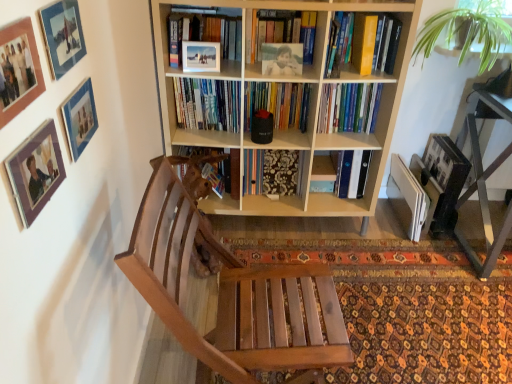
This screenshot has width=512, height=384. Identify the location of matte glass picture frame at upper left, arranged as the 4th picture frame when ordered from the bottom. (62, 36).

Image resolution: width=512 pixels, height=384 pixels. Describe the element at coordinates (233, 294) in the screenshot. I see `wooden chair at center` at that location.

The height and width of the screenshot is (384, 512). What do you see at coordinates (349, 107) in the screenshot?
I see `hardcover books at center, the second book when ordered from top to bottom` at bounding box center [349, 107].

The image size is (512, 384). Find the location of `yellow hardcover book at upper right, arranged as the first book when viewed from the top`. yellow hardcover book at upper right, arranged as the first book when viewed from the top is located at coordinates (362, 42).

The width and height of the screenshot is (512, 384). Find the location of `the 3rd picture frame behind the matte wooden picture frame at upper left, which is the 2th picture frame in top-to-bottom order`. the 3rd picture frame behind the matte wooden picture frame at upper left, which is the 2th picture frame in top-to-bottom order is located at coordinates (79, 118).

How many degrees apart are the facing directions of matte wooden picture frame at upper left, which is the 2th picture frame in top-to-bottom order, and matte blue picture frame at upper left, which is the 2th picture frame from bottom to top?

The angular difference between matte wooden picture frame at upper left, which is the 2th picture frame in top-to-bottom order, and matte blue picture frame at upper left, which is the 2th picture frame from bottom to top, is 0.0258 degrees.

Based on the photo, is matte wooden picture frame at upper left, which is the third picture frame in bottom-to-top order, next to matte blue picture frame at upper left, which is the 2th picture frame from bottom to top, and touching it?

No, matte wooden picture frame at upper left, which is the third picture frame in bottom-to-top order, is not in contact with matte blue picture frame at upper left, which is the 2th picture frame from bottom to top.

Between point (5, 74) and point (70, 112), which one is positioned in front?

The point (5, 74) is more forward.

In the scene shown: Is wooden chair at center located within yellow hardcover book at upper right, arranged as the first book when viewed from the top?

No.

Considering the positions of objects yellow hardcover book at upper right, arranged as the first book when viewed from the top, and wooden chair at center in the image provided, who is behind, yellow hardcover book at upper right, arranged as the first book when viewed from the top, or wooden chair at center?

yellow hardcover book at upper right, arranged as the first book when viewed from the top, is further away from the camera.

From a real-world perspective, which object rests below the other?

From a 3D spatial view, wooden chair at center is below.

From the image's perspective, between yellow hardcover book at upper right, arranged as the first book when viewed from the top, and wooden chair at center, who is located below?

wooden chair at center, from the image's perspective.

From their relative heights in the image, would you say matte glass picture frame at upper left, the 1th picture frame viewed from the top, is taller or shorter than green leafy plant at upper right?

Considering their sizes, matte glass picture frame at upper left, the 1th picture frame viewed from the top, has less height than green leafy plant at upper right.

Which object is further away from the camera, matte glass picture frame at upper left, the 1th picture frame viewed from the top, or green leafy plant at upper right?

green leafy plant at upper right is further away from the camera.

Is matte glass picture frame at upper left, arranged as the 4th picture frame when ordered from the bottom, inside or outside of green leafy plant at upper right?

matte glass picture frame at upper left, arranged as the 4th picture frame when ordered from the bottom, cannot be found inside green leafy plant at upper right.

From a real-world perspective, count 4th picture frames upward from the green leafy plant at upper right and point to it. Please provide its 2D coordinates.

[(62, 36)]

Is yellow hardcover book at upper right, the second book positioned from the bottom, surrounding matte glass picture frame at upper left, arranged as the 4th picture frame when ordered from the bottom?

No, matte glass picture frame at upper left, arranged as the 4th picture frame when ordered from the bottom, is located outside of yellow hardcover book at upper right, the second book positioned from the bottom.

Are yellow hardcover book at upper right, the second book positioned from the bottom, and matte glass picture frame at upper left, the 1th picture frame viewed from the top, far apart?

Yes, yellow hardcover book at upper right, the second book positioned from the bottom, and matte glass picture frame at upper left, the 1th picture frame viewed from the top, are located far from each other.

From the image's perspective, is yellow hardcover book at upper right, the second book positioned from the bottom, located beneath matte glass picture frame at upper left, arranged as the 4th picture frame when ordered from the bottom?

No, from the image's perspective, yellow hardcover book at upper right, the second book positioned from the bottom, is not beneath matte glass picture frame at upper left, arranged as the 4th picture frame when ordered from the bottom.

Is yellow hardcover book at upper right, arranged as the first book when viewed from the top, facing away from matte glass picture frame at upper left, the 1th picture frame viewed from the top?

No, yellow hardcover book at upper right, arranged as the first book when viewed from the top, is not facing the opposite direction of matte glass picture frame at upper left, the 1th picture frame viewed from the top.

Which object is further away from the camera, metallic black table at right or hardcover books at center, the 1th book in the bottom-to-top sequence?

hardcover books at center, the 1th book in the bottom-to-top sequence, is more distant.

From the picture: Is metallic black table at right facing away from hardcover books at center, the second book when ordered from top to bottom?

metallic black table at right does not have its back to hardcover books at center, the second book when ordered from top to bottom.

Image resolution: width=512 pixels, height=384 pixels. Identify the location of table that is below the hardcover books at center, the 1th book in the bottom-to-top sequence (from the image's perspective). (485, 170).

Looking at this image, can hardcover books at center, the second book when ordered from top to bottom, be found inside metallic black table at right?

That's incorrect, hardcover books at center, the second book when ordered from top to bottom, is not inside metallic black table at right.

Who is taller, light wood bookcase at center or metallic black table at right?

With more height is light wood bookcase at center.

From the image's perspective, which one is positioned higher, light wood bookcase at center or metallic black table at right?

light wood bookcase at center is shown above in the image.

Which is behind, point (340, 129) or point (480, 22)?

Positioned behind is point (340, 129).

Are hardcover books at center, the 1th book in the bottom-to-top sequence, and green leafy plant at upper right beside each other?

hardcover books at center, the 1th book in the bottom-to-top sequence, is not next to green leafy plant at upper right, and they're not touching.

In the scene shown: Is the position of hardcover books at center, the 1th book in the bottom-to-top sequence, more distant than that of green leafy plant at upper right?

Yes, it is.

Considering the sizes of hardcover books at center, the second book when ordered from top to bottom, and green leafy plant at upper right in the image, is hardcover books at center, the second book when ordered from top to bottom, wider or thinner than green leafy plant at upper right?

In the image, hardcover books at center, the second book when ordered from top to bottom, appears to be more narrow than green leafy plant at upper right.

This screenshot has height=384, width=512. Identify the location of the 2nd picture frame below the matte wooden picture frame at upper left, which is the 2th picture frame in top-to-bottom order (from a real-world perspective). (79, 118).

Which book is the 2nd one when counting from the right side of the wooden chair at center? Please provide its 2D coordinates.

[(362, 42)]

When comparing their distances from matte wooden picture frame at upper left, which is the 2th picture frame in top-to-bottom order, does metallic black table at right or yellow hardcover book at upper right, arranged as the first book when viewed from the top, seem closer?

yellow hardcover book at upper right, arranged as the first book when viewed from the top, is closer to matte wooden picture frame at upper left, which is the 2th picture frame in top-to-bottom order.

From the image, which object appears to be nearer to green leafy plant at upper right, yellow hardcover book at upper right, the second book positioned from the bottom, or wooden chair at center?

yellow hardcover book at upper right, the second book positioned from the bottom, is positioned closer to the anchor green leafy plant at upper right.

From the image, which object appears to be farther from wooden picture frame at upper left, arranged as the first picture frame when ordered from the bottom, green leafy plant at upper right or matte glass picture frame at upper left, the 1th picture frame viewed from the top?

Based on the image, green leafy plant at upper right appears to be further to wooden picture frame at upper left, arranged as the first picture frame when ordered from the bottom.

Based on their spatial positions, is yellow hardcover book at upper right, arranged as the first book when viewed from the top, or hardcover books at center, the 1th book in the bottom-to-top sequence, further from wooden chair at center?

yellow hardcover book at upper right, arranged as the first book when viewed from the top, lies further to wooden chair at center than the other object.

Based on their spatial positions, is yellow hardcover book at upper right, the second book positioned from the bottom, or green leafy plant at upper right closer to wooden picture frame at upper left, marked as the 4th picture frame in a top-to-bottom arrangement?

yellow hardcover book at upper right, the second book positioned from the bottom, is closer to wooden picture frame at upper left, marked as the 4th picture frame in a top-to-bottom arrangement.

Looking at the image, which one is located closer to yellow hardcover book at upper right, the second book positioned from the bottom, metallic black table at right or matte glass picture frame at upper left, arranged as the 4th picture frame when ordered from the bottom?

metallic black table at right.

Looking at the image, which one is located further to green leafy plant at upper right, yellow hardcover book at upper right, arranged as the first book when viewed from the top, or matte blue picture frame at upper left, marked as the third picture frame in a top-to-bottom arrangement?

Based on the image, matte blue picture frame at upper left, marked as the third picture frame in a top-to-bottom arrangement, appears to be further to green leafy plant at upper right.

Based on their spatial positions, is wooden picture frame at upper left, marked as the 4th picture frame in a top-to-bottom arrangement, or matte blue picture frame at upper left, marked as the third picture frame in a top-to-bottom arrangement, closer to green leafy plant at upper right?

Among the two, matte blue picture frame at upper left, marked as the third picture frame in a top-to-bottom arrangement, is located nearer to green leafy plant at upper right.

You are a GUI agent. You are given a task and a screenshot of the screen. Output one action in this format:
    pyautogui.click(x=<x>, y=<y>)
    Task: Click on the chair between matte wooden picture frame at upper left, which is the third picture frame in bottom-to-top order, and metallic black table at right
    
    Given the screenshot: What is the action you would take?
    pyautogui.click(x=233, y=294)

Find the location of a particular element. picture frame between matte blue picture frame at upper left, marked as the third picture frame in a top-to-bottom arrangement, and wooden chair at center vertically is located at coordinates (35, 171).

The image size is (512, 384). What are the coordinates of `chair located between matte wooden picture frame at upper left, which is the third picture frame in bottom-to-top order, and green leafy plant at upper right in the left-right direction` in the screenshot? It's located at (233, 294).

You are a GUI agent. You are given a task and a screenshot of the screen. Output one action in this format:
    pyautogui.click(x=<x>, y=<y>)
    Task: Click on the chair between wooden picture frame at upper left, arranged as the first picture frame when ordered from the bottom, and yellow hardcover book at upper right, the second book positioned from the bottom, from front to back
    Image resolution: width=512 pixels, height=384 pixels.
    Given the screenshot: What is the action you would take?
    pyautogui.click(x=233, y=294)